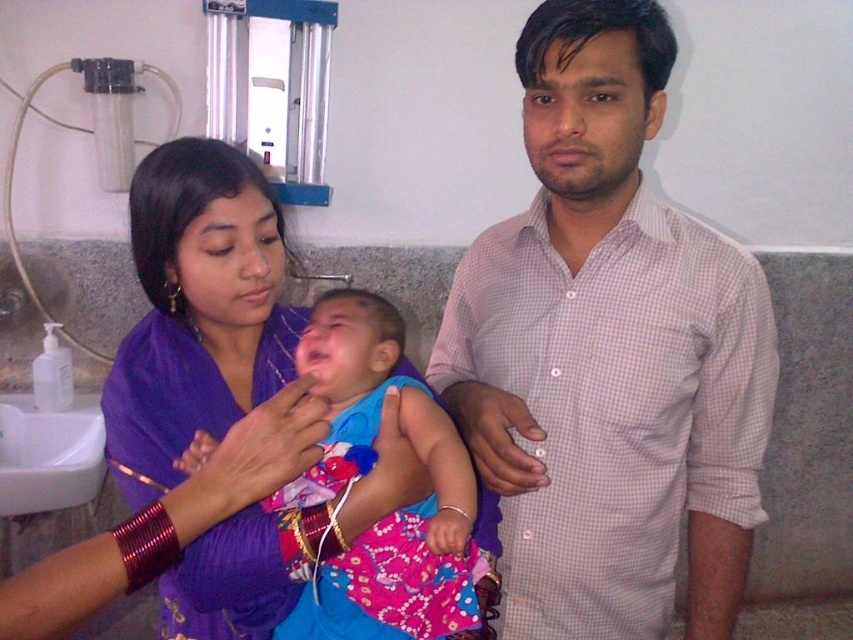
Question: Can you confirm if pink checkered shirt at center is positioned below purple fabric at center?

Choices:
 (A) yes
 (B) no

Answer: (B)

Question: Can you confirm if pink checkered shirt at center is wider than purple fabric at center?

Choices:
 (A) yes
 (B) no

Answer: (B)

Question: Which point is closer to the camera?

Choices:
 (A) (227, 365)
 (B) (671, 257)

Answer: (B)

Question: Does pink checkered shirt at center appear under purple fabric at center?

Choices:
 (A) no
 (B) yes

Answer: (A)

Question: Which object is farther from the camera taking this photo?

Choices:
 (A) pink checkered shirt at center
 (B) purple fabric at center

Answer: (A)